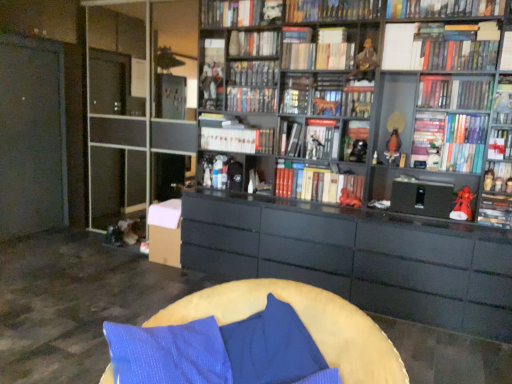
The height and width of the screenshot is (384, 512). I want to click on vacant area on top of black matte bookshelf at center, which appears as the 9th book when viewed from the top (from a real-world perspective), so click(254, 86).